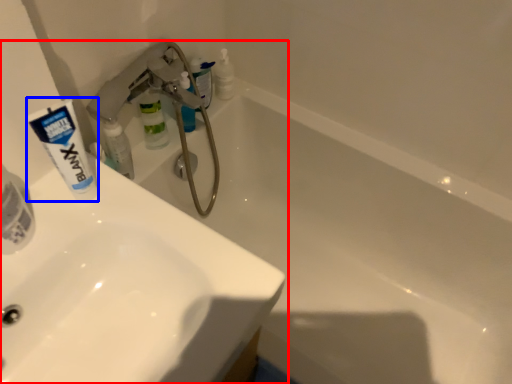
Question: Which object is closer to the camera taking this photo, sink (highlighted by a red box) or toothpaste (highlighted by a blue box)?

Choices:
 (A) sink
 (B) toothpaste

Answer: (A)